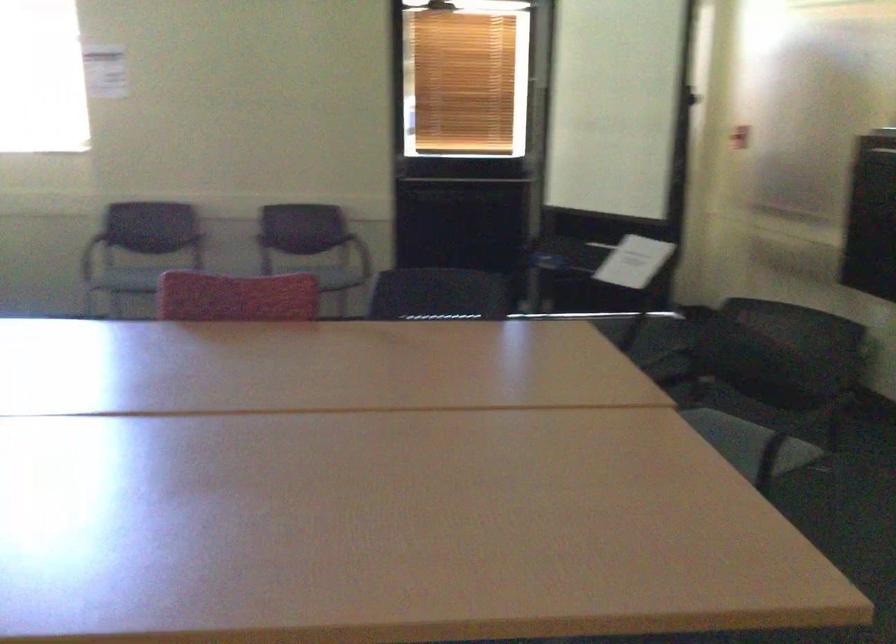
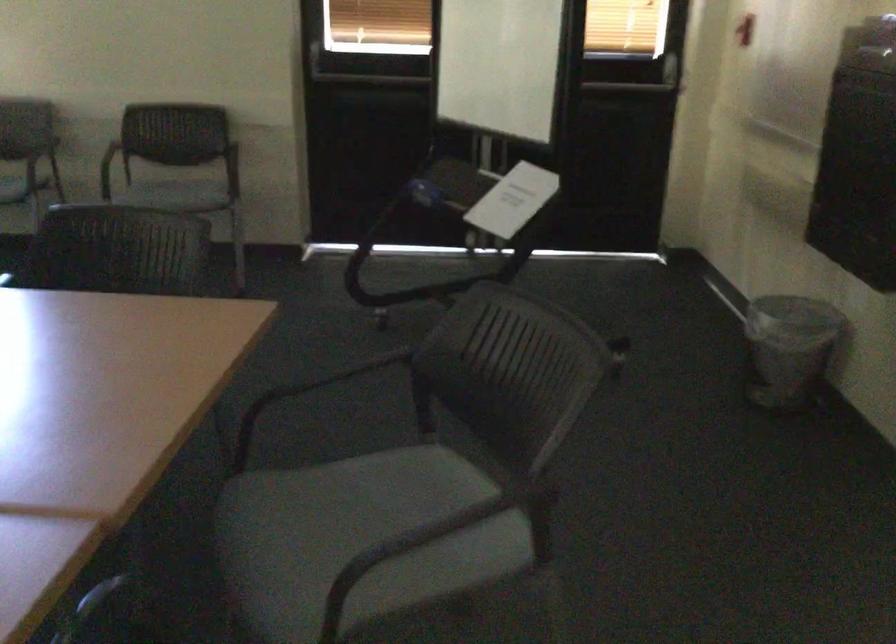
Find the pixel in the second image that matches [627,254] in the first image.

(513, 200)